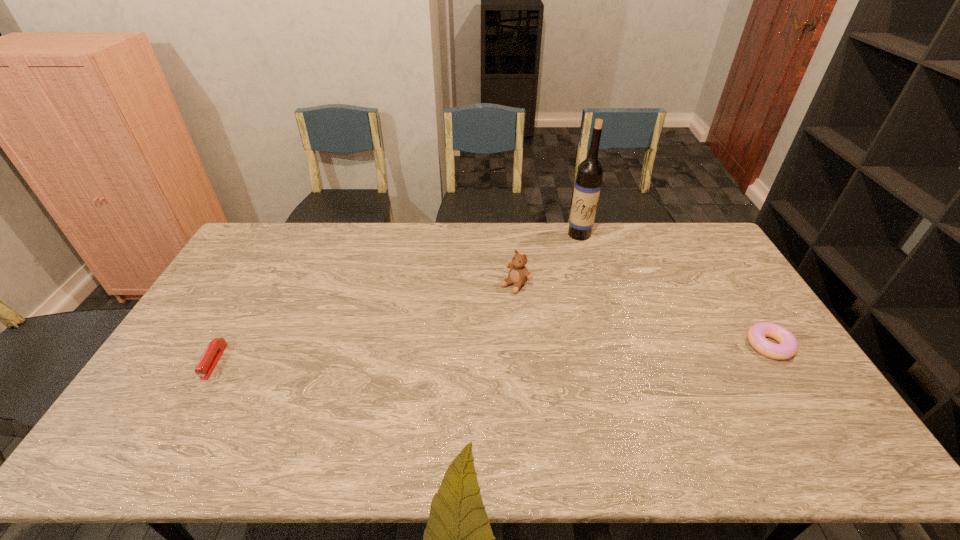
Find the location of a particular element. Image resolution: width=960 pixels, height=540 pixels. vacant space on the desktop that is between the stapler and the rightmost object and is positioned on the label of the farthest object is located at coordinates pyautogui.click(x=531, y=352).

You are a GUI agent. You are given a task and a screenshot of the screen. Output one action in this format:
    pyautogui.click(x=<x>, y=<y>)
    Task: Click on the free space on the desktop that is between the leftmost object and the doughnut and is positioned on the front-facing side of the second farthest object
    
    Given the screenshot: What is the action you would take?
    pyautogui.click(x=433, y=355)